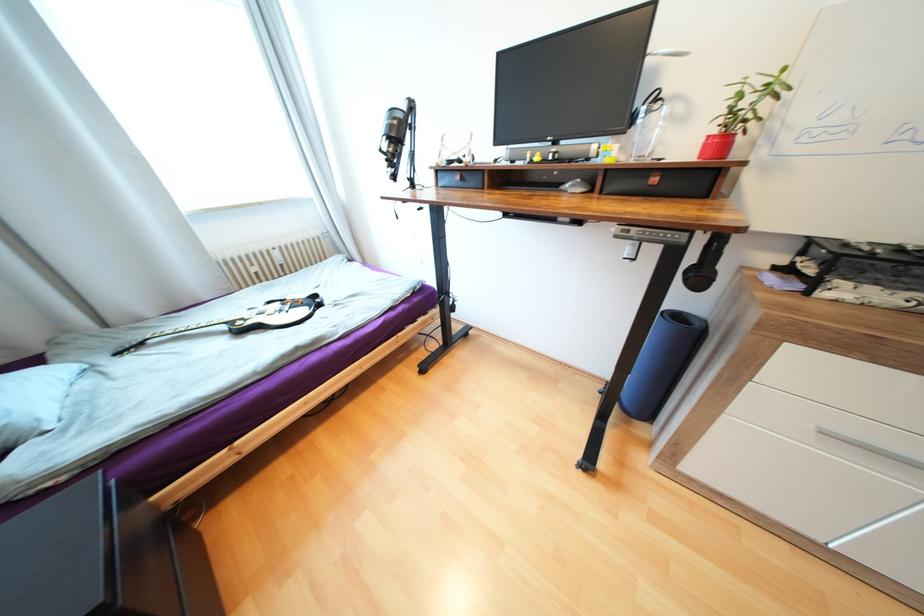
Where would you pull the white drawer handle? Please return your answer as a coordinate pair (x, y).

(870, 448)